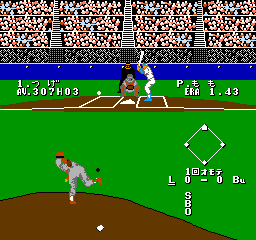
Identify the location of fans in stand on right. (240, 38).